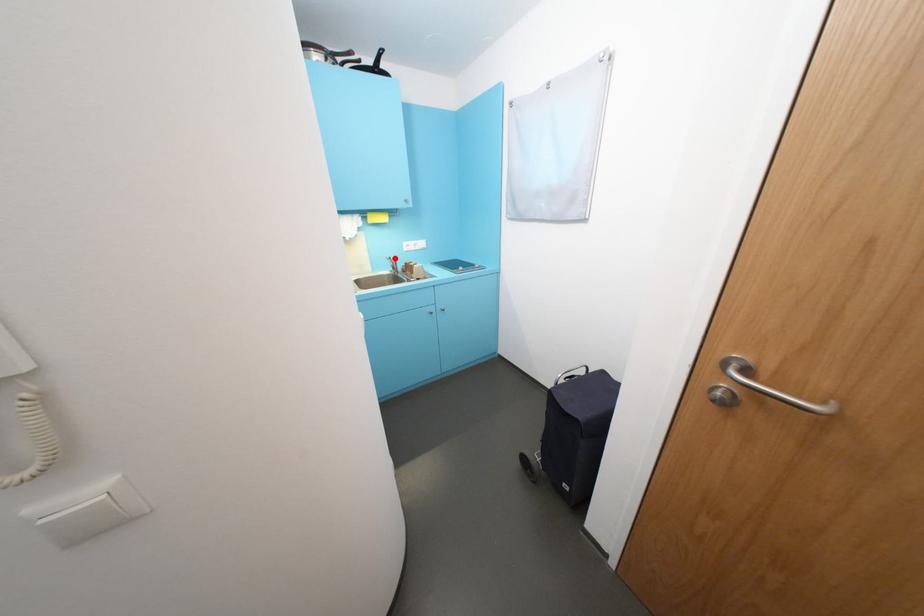
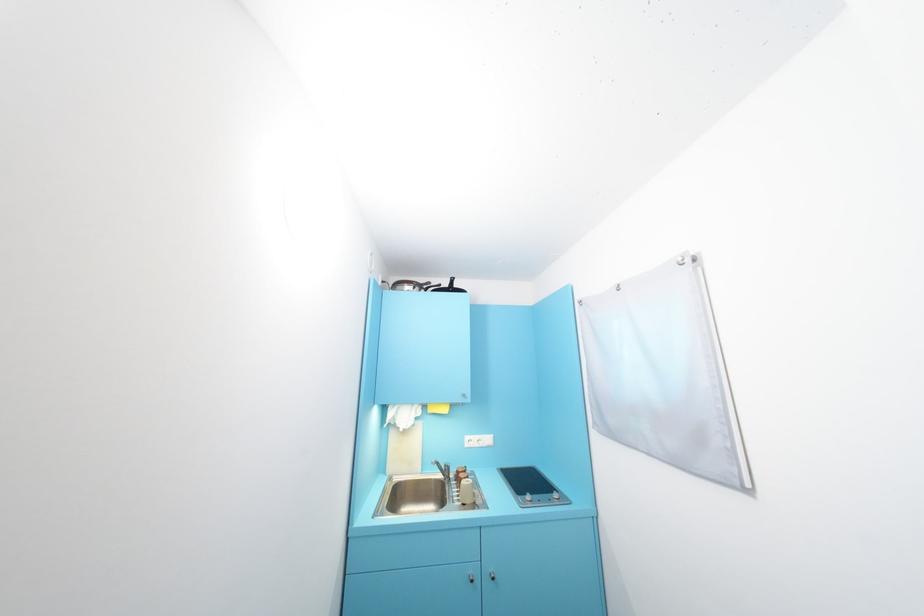
The point at the highlighted location is marked in the first image. Where is the corresponding point in the second image?

(440, 463)